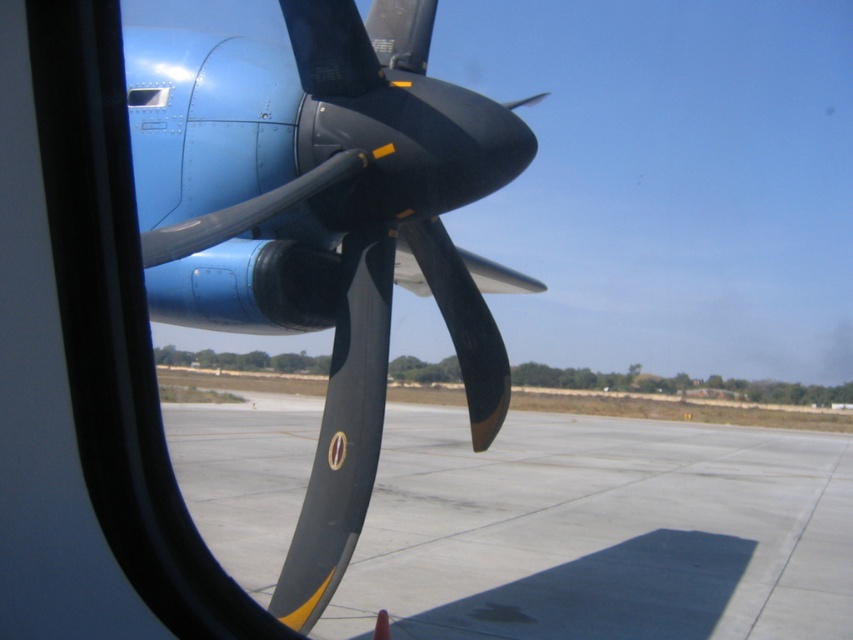
You are standing inside the aircraft looking out the window. You see two points on the tarmac outside. The first point is at coordinate point (437, 461) and the second is at point (167, 88). Which point is closer to you?

Point (167, 88) is closer to you because it is in front of point (437, 461).

Based on the photo, you are a passenger sitting in the aircraft and looking out through the transparent glass airplane window at upper left. You notice the gray concrete tarmac at center below. Can you determine the spatial relationship between these two objects from your vantage point?

The gray concrete tarmac at center is positioned under the transparent glass airplane window at upper left, meaning the tarmac is located directly beneath the window from your viewpoint.

You are a pilot trying to determine the position of the gray concrete tarmac at center relative to the aircraft. Based on the coordinates provided, can you specify its exact location in the image?

The gray concrete tarmac at center is located at the 2D coordinates point (601, 531) in the image.